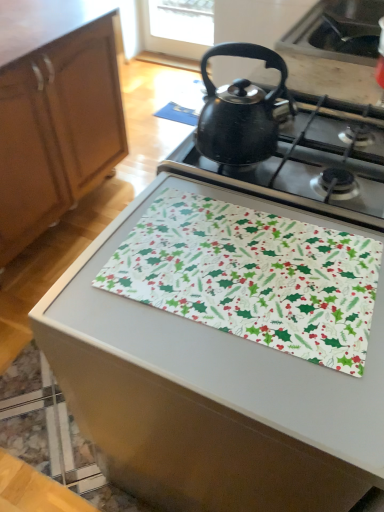
Where is `white fabric placemat at center`? This screenshot has width=384, height=512. white fabric placemat at center is located at coordinates click(210, 393).

What is the approximate height of wooden cabinet at left?

It is 33.67 inches.

The width and height of the screenshot is (384, 512). What do you see at coordinates (309, 163) in the screenshot?
I see `black matte kettle at upper center` at bounding box center [309, 163].

At what (x,y) coordinates should I click in order to perform the action: click on white fabric placemat at center. Please return your answer as a coordinate pair (x, y). Looking at the image, I should click on (210, 393).

From a real-world perspective, is wooden cabinet at left positioned over black matte kettle at upper center based on gravity?

No, from a real-world perspective, wooden cabinet at left is not on top of black matte kettle at upper center.

Does wooden cabinet at left have a greater height compared to black matte kettle at upper center?

Yes.

Considering the relative positions of wooden cabinet at left and black matte kettle at upper center in the image provided, is wooden cabinet at left to the left of black matte kettle at upper center from the viewer's perspective?

Correct, you'll find wooden cabinet at left to the left of black matte kettle at upper center.

Does wooden cabinet at left contain black matte kettle at upper center?

No, wooden cabinet at left does not contain black matte kettle at upper center.

Is there a large distance between black matte kettle at upper center and black matte sink at upper right?

black matte kettle at upper center is near black matte sink at upper right, not far away.

Is black matte kettle at upper center at the right side of black matte sink at upper right?

Incorrect, black matte kettle at upper center is not on the right side of black matte sink at upper right.

From the image's perspective, is black matte kettle at upper center over black matte sink at upper right?

No, from the image's perspective, black matte kettle at upper center is not on top of black matte sink at upper right.

Which is closer, (213, 138) or (331, 51)?

Point (213, 138) appears to be closer to the viewer than point (331, 51).

Considering the sizes of objects white fabric placemat at center and black matte kettle at upper center in the image provided, who is taller, white fabric placemat at center or black matte kettle at upper center?

With more height is white fabric placemat at center.

Does white fabric placemat at center have a smaller size compared to black matte kettle at upper center?

No.

Is white fabric placemat at center facing towards black matte kettle at upper center?

No, white fabric placemat at center is not aimed at black matte kettle at upper center.

Considering the positions of objects white fabric placemat at center and black matte kettle at upper center in the image provided, who is more to the right, white fabric placemat at center or black matte kettle at upper center?

black matte kettle at upper center.

Can white fabric placemat at center be found inside white fabric with holiday pattern at center?

No, white fabric placemat at center is not a part of white fabric with holiday pattern at center.

Considering the sizes of objects white fabric with holiday pattern at center and white fabric placemat at center in the image provided, who is taller, white fabric with holiday pattern at center or white fabric placemat at center?

With more height is white fabric placemat at center.

Does white fabric with holiday pattern at center have a larger size compared to white fabric placemat at center?

Actually, white fabric with holiday pattern at center might be smaller than white fabric placemat at center.

From the image's perspective, would you say white fabric with holiday pattern at center is shown under white fabric placemat at center?

Incorrect, from the image's perspective, white fabric with holiday pattern at center is higher than white fabric placemat at center.

From the picture: Is white fabric with holiday pattern at center bigger or smaller than wooden cabinet at left?

Considering their sizes, white fabric with holiday pattern at center takes up less space than wooden cabinet at left.

Identify the location of cabinetry below the white fabric with holiday pattern at center (from a real-world perspective). (57, 129).

Can you confirm if white fabric with holiday pattern at center is shorter than wooden cabinet at left?

Correct, white fabric with holiday pattern at center is not as tall as wooden cabinet at left.

Which object is more forward, white fabric with holiday pattern at center or black matte sink at upper right?

Positioned in front is white fabric with holiday pattern at center.

Who is bigger, white fabric with holiday pattern at center or black matte sink at upper right?

Bigger between the two is black matte sink at upper right.

From the image's perspective, who appears lower, white fabric with holiday pattern at center or black matte sink at upper right?

From the image's view, white fabric with holiday pattern at center is below.

Is black matte kettle at upper center inside the boundaries of white fabric with holiday pattern at center, or outside?

The correct answer is: outside.

Can you see black matte kettle at upper center touching white fabric with holiday pattern at center?

black matte kettle at upper center and white fabric with holiday pattern at center are not in contact.

From the image's perspective, is black matte kettle at upper center located above white fabric with holiday pattern at center?

Yes, from the image's perspective, black matte kettle at upper center is above white fabric with holiday pattern at center.

The height and width of the screenshot is (512, 384). What are the coordinates of `cabinetry on the left of black matte kettle at upper center` in the screenshot? It's located at (x=57, y=129).

The height and width of the screenshot is (512, 384). I want to click on sink lying on the right of black matte kettle at upper center, so click(338, 31).

Considering their positions, is white fabric placemat at center positioned closer to white fabric with holiday pattern at center than black matte kettle at upper center?

Based on the image, white fabric placemat at center appears to be nearer to white fabric with holiday pattern at center.

Looking at the image, which one is located closer to white fabric with holiday pattern at center, black matte kettle at upper center or black matte kettle at upper center?

The object closer to white fabric with holiday pattern at center is black matte kettle at upper center.

Based on their spatial positions, is black matte kettle at upper center or wooden cabinet at left closer to black matte sink at upper right?

Based on the image, black matte kettle at upper center appears to be nearer to black matte sink at upper right.

Based on their spatial positions, is white fabric placemat at center or white fabric with holiday pattern at center closer to black matte sink at upper right?

white fabric with holiday pattern at center is positioned closer to the anchor black matte sink at upper right.

From the image, which object appears to be nearer to white fabric with holiday pattern at center, wooden cabinet at left or black matte kettle at upper center?

black matte kettle at upper center lies closer to white fabric with holiday pattern at center than the other object.

When comparing their distances from white fabric with holiday pattern at center, does black matte kettle at upper center or black matte sink at upper right seem further?

black matte sink at upper right is further to white fabric with holiday pattern at center.

From the image, which object appears to be farther from white fabric with holiday pattern at center, black matte kettle at upper center or wooden cabinet at left?

wooden cabinet at left.

Considering their positions, is white fabric placemat at center positioned closer to white fabric with holiday pattern at center than wooden cabinet at left?

The object closer to white fabric with holiday pattern at center is white fabric placemat at center.

The width and height of the screenshot is (384, 512). What are the coordinates of `kettle situated between wooden cabinet at left and black matte kettle at upper center from left to right` in the screenshot? It's located at (241, 111).

Identify the location of blanket between wooden cabinet at left and black matte kettle at upper center in the horizontal direction. The image size is (384, 512). (252, 276).

Image resolution: width=384 pixels, height=512 pixels. Identify the location of blanket between black matte kettle at upper center and white fabric placemat at center in the vertical direction. (252, 276).

Identify the location of gas stove between wooden cabinet at left and black matte sink at upper right in the horizontal direction. (309, 163).